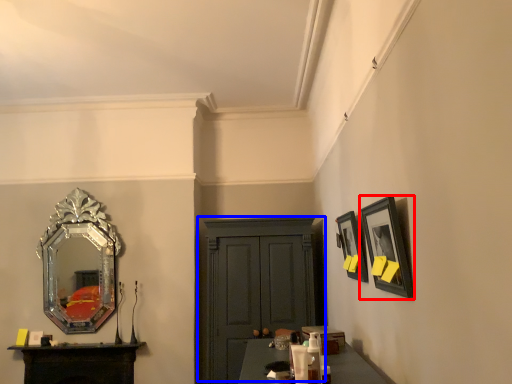
Question: Which object appears farthest to the camera in this image, picture frame (highlighted by a red box) or cabinetry (highlighted by a blue box)?

Choices:
 (A) picture frame
 (B) cabinetry

Answer: (B)